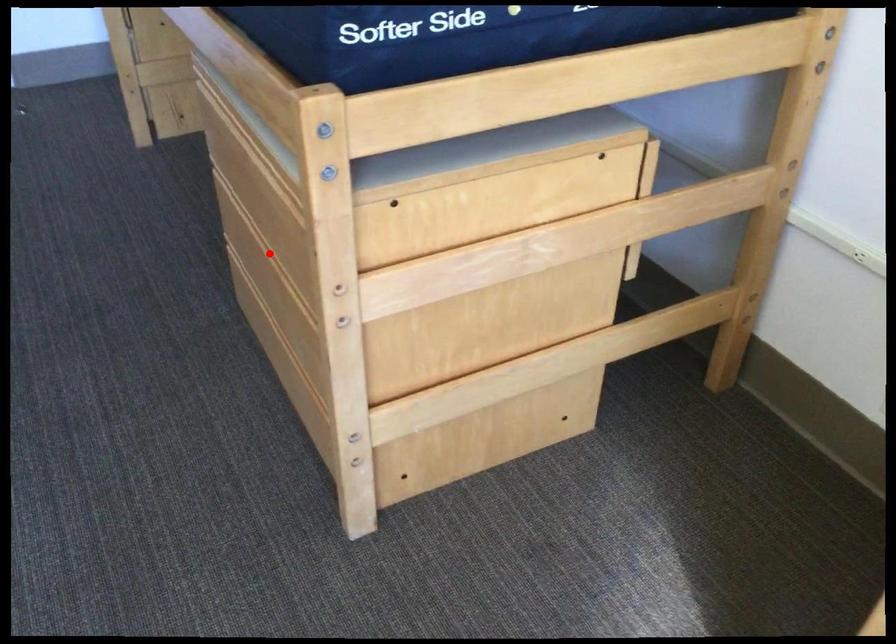
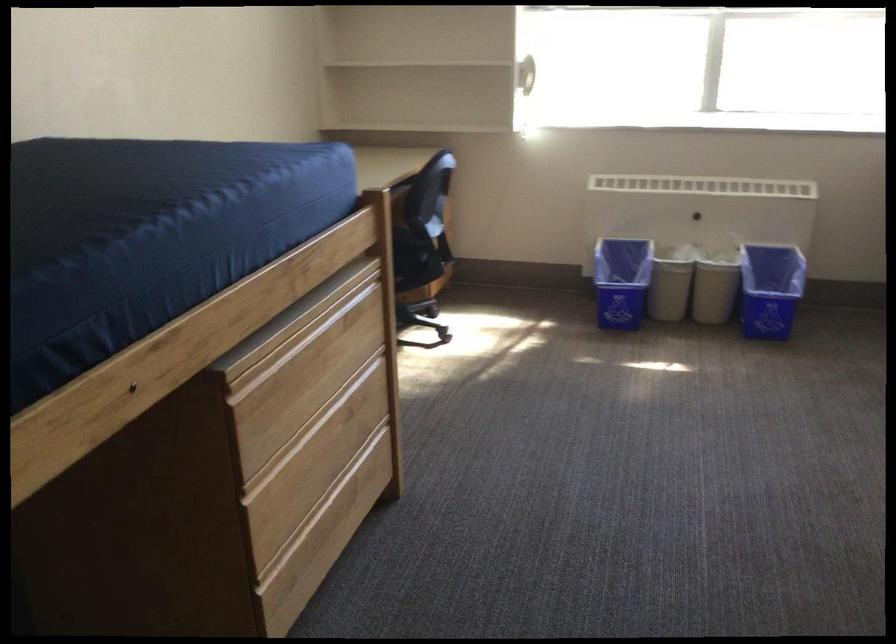
Question: I am providing you with two images of the same scene from different viewpoints. In image1, a red point is highlighted. Considering the same 3D point in image2, which of the following is correct?

Choices:
 (A) It is closer
 (B) It is farther

Answer: (B)